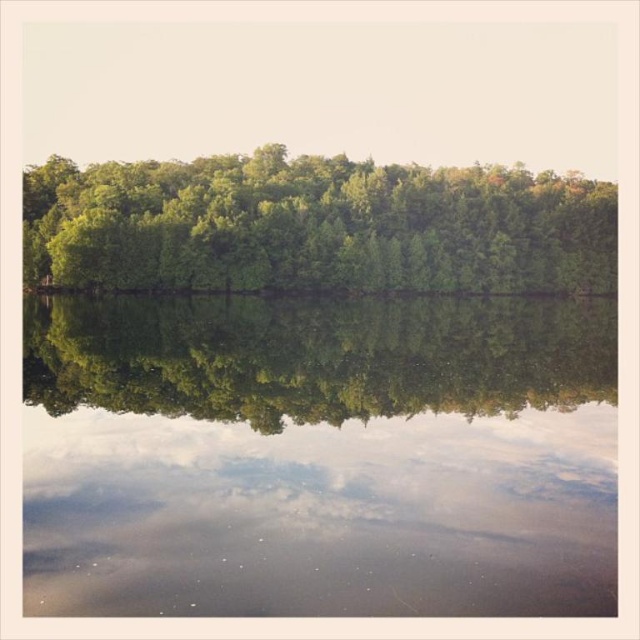
Which is behind, point (26, 316) or point (257, 196)?

The point (257, 196) is more distant.

Does transparent water at center have a larger size compared to green leafy trees at center?

Actually, transparent water at center might be smaller than green leafy trees at center.

Image resolution: width=640 pixels, height=640 pixels. What are the coordinates of `transparent water at center` in the screenshot? It's located at (320, 456).

Where is `transparent water at center`? transparent water at center is located at coordinates (320, 456).